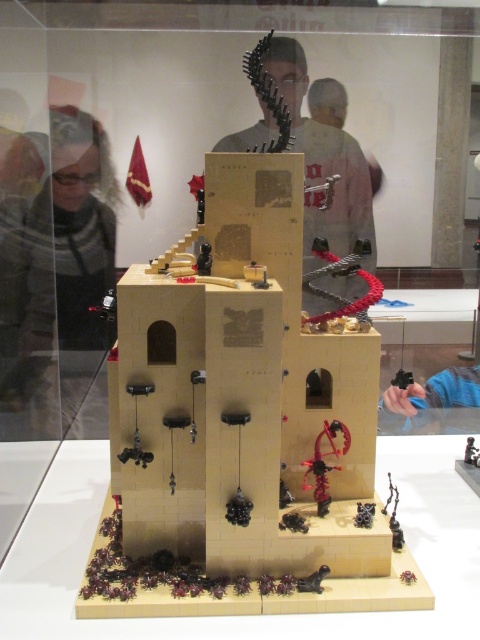
Question: Can you confirm if matte gray sweater at left is wider than matte black sculpture at center?

Choices:
 (A) yes
 (B) no

Answer: (B)

Question: Which point is farther from the camera taking this photo?

Choices:
 (A) (305, 161)
 (B) (51, 387)

Answer: (B)

Question: Is matte gray sweater at left above matte black sculpture at center?

Choices:
 (A) yes
 (B) no

Answer: (B)

Question: Is matte gray sweater at left below matte black sculpture at center?

Choices:
 (A) yes
 (B) no

Answer: (A)

Question: Which object is farther from the camera taking this photo?

Choices:
 (A) matte black sculpture at center
 (B) matte gray sweater at left

Answer: (B)